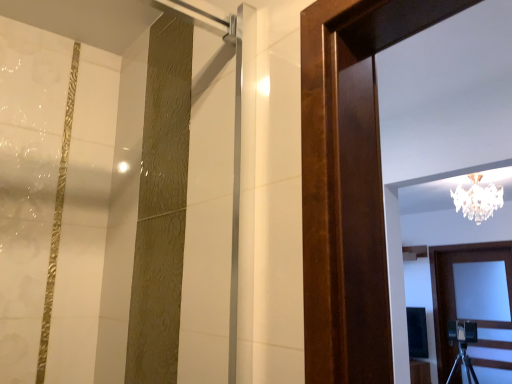
This screenshot has height=384, width=512. Describe the element at coordinates (475, 309) in the screenshot. I see `white wooden door at lower right` at that location.

This screenshot has width=512, height=384. What are the coordinates of `white wooden door at lower right` in the screenshot? It's located at (475, 309).

What do you see at coordinates (477, 199) in the screenshot? The width and height of the screenshot is (512, 384). I see `clear crystal chandelier at upper center` at bounding box center [477, 199].

In order to face clear crystal chandelier at upper center, should I rotate leftwards or rightwards?

Turn right approximately 27.624 degrees to face it.

What is the approximate width of clear crystal chandelier at upper center?

clear crystal chandelier at upper center is 21.15 inches in width.

This screenshot has height=384, width=512. I want to click on clear crystal chandelier at upper center, so click(x=477, y=199).

What are the coordinates of `white wooden door at lower right` in the screenshot? It's located at (475, 309).

Which object is positioned more to the left, white wooden door at lower right or clear crystal chandelier at upper center?

clear crystal chandelier at upper center is more to the left.

Considering their positions, is white wooden door at lower right located in front of or behind clear crystal chandelier at upper center?

Clearly, white wooden door at lower right is behind clear crystal chandelier at upper center.

Which is closer, [505,382] or [457,209]?

Positioned in front is point [457,209].

From the image's perspective, is white wooden door at lower right above or below clear crystal chandelier at upper center?

white wooden door at lower right is below clear crystal chandelier at upper center.

From a real-world perspective, is white wooden door at lower right physically below clear crystal chandelier at upper center?

Yes, from a real-world perspective, white wooden door at lower right is below clear crystal chandelier at upper center.

Based on the photo, which object is wider, white wooden door at lower right or clear crystal chandelier at upper center?

Wider between the two is clear crystal chandelier at upper center.

Can you confirm if white wooden door at lower right is shorter than clear crystal chandelier at upper center?

In fact, white wooden door at lower right may be taller than clear crystal chandelier at upper center.

Is white wooden door at lower right smaller than clear crystal chandelier at upper center?

Actually, white wooden door at lower right might be larger than clear crystal chandelier at upper center.

Could clear crystal chandelier at upper center be considered to be inside white wooden door at lower right?

Answer: No, clear crystal chandelier at upper center is located outside of white wooden door at lower right.

Would you say white wooden door at lower right is a long distance from clear crystal chandelier at upper center?

Absolutely, white wooden door at lower right is distant from clear crystal chandelier at upper center.

Does white wooden door at lower right turn towards clear crystal chandelier at upper center?

Yes, white wooden door at lower right is oriented towards clear crystal chandelier at upper center.

Locate an element on the screen. door located on the right of clear crystal chandelier at upper center is located at coordinates (475, 309).

Considering the positions of objects clear crystal chandelier at upper center and white wooden door at lower right in the image provided, who is more to the right, clear crystal chandelier at upper center or white wooden door at lower right?

white wooden door at lower right is more to the right.

Is the position of clear crystal chandelier at upper center more distant than that of white wooden door at lower right?

No, clear crystal chandelier at upper center is closer to the camera.

Between point (479, 206) and point (460, 304), which one is positioned in front?

Positioned in front is point (479, 206).

From the image's perspective, which is above, clear crystal chandelier at upper center or white wooden door at lower right?

clear crystal chandelier at upper center appears higher in the image.

Consider the image. From a real-world perspective, is clear crystal chandelier at upper center positioned above or below white wooden door at lower right?

clear crystal chandelier at upper center is above white wooden door at lower right.

Based on the photo, is clear crystal chandelier at upper center wider than white wooden door at lower right?

Correct, the width of clear crystal chandelier at upper center exceeds that of white wooden door at lower right.

Considering the sizes of clear crystal chandelier at upper center and white wooden door at lower right in the image, is clear crystal chandelier at upper center taller or shorter than white wooden door at lower right?

clear crystal chandelier at upper center is shorter than white wooden door at lower right.

Considering the relative sizes of clear crystal chandelier at upper center and white wooden door at lower right in the image provided, is clear crystal chandelier at upper center bigger than white wooden door at lower right?

Actually, clear crystal chandelier at upper center might be smaller than white wooden door at lower right.

Is clear crystal chandelier at upper center positioned beyond the bounds of white wooden door at lower right?

Yes, clear crystal chandelier at upper center is not within white wooden door at lower right.

Are clear crystal chandelier at upper center and white wooden door at lower right far apart?

That's right, there is a large distance between clear crystal chandelier at upper center and white wooden door at lower right.

Is clear crystal chandelier at upper center aimed at white wooden door at lower right?

No.

What's the angular difference between clear crystal chandelier at upper center and white wooden door at lower right's facing directions?

11.5 degrees separate the facing orientations of clear crystal chandelier at upper center and white wooden door at lower right.

How much distance is there between clear crystal chandelier at upper center and white wooden door at lower right?

clear crystal chandelier at upper center is 1.21 meters from white wooden door at lower right.

This screenshot has width=512, height=384. Identify the location of lamp positioned vertically above the white wooden door at lower right (from a real-world perspective). (477, 199).

Identify the location of door on the right of clear crystal chandelier at upper center. (475, 309).

Identify the location of lamp that is above the white wooden door at lower right (from a real-world perspective). (477, 199).